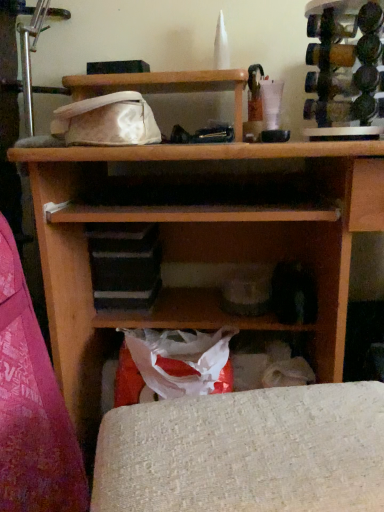
Describe the element at coordinates (32, 406) in the screenshot. This screenshot has width=384, height=512. I see `white paper bag at lower left` at that location.

The image size is (384, 512). Identify the location of white paper bag at lower left. (32, 406).

What is the approximate height of white paper bag at lower left?

28.42 inches.

At what (x,y) coordinates should I click in order to perform the action: click on white paper bag at lower left. Please return your answer as a coordinate pair (x, y). This screenshot has height=512, width=384. Looking at the image, I should click on [32, 406].